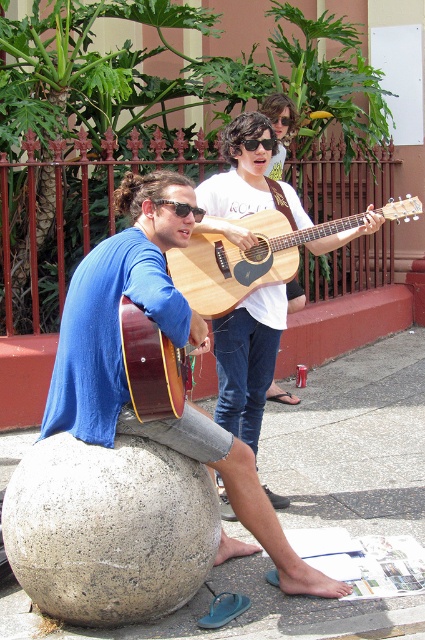
Can you confirm if gray concrete ball at lower left is taller than gray concrete sphere at lower left?

Correct, gray concrete ball at lower left is much taller as gray concrete sphere at lower left.

Does gray concrete ball at lower left have a lesser width compared to gray concrete sphere at lower left?

In fact, gray concrete ball at lower left might be wider than gray concrete sphere at lower left.

Between point (421, 340) and point (167, 472), which one is positioned in front?

Point (167, 472) is in front.

What are the coordinates of `gray concrete ball at lower left` in the screenshot? It's located at (354, 442).

Consider the image. Can you confirm if matte blue shirt at left is positioned to the right of natural wood guitar at center?

No, matte blue shirt at left is not to the right of natural wood guitar at center.

Does matte blue shirt at left have a lesser width compared to natural wood guitar at center?

No, matte blue shirt at left is not thinner than natural wood guitar at center.

Between point (90, 397) and point (243, 396), which one is positioned behind?

The point (243, 396) is more distant.

At what (x,y) coordinates should I click in order to perform the action: click on matte blue shirt at left. Please return your answer as a coordinate pair (x, y). The height and width of the screenshot is (640, 425). Looking at the image, I should click on (173, 342).

Is natural wood acoustic guitar at center bigger than sunglasses at center?

Yes.

Is the position of natural wood acoustic guitar at center more distant than that of sunglasses at center?

Yes, it is.

Does point (416, 212) come closer to viewer compared to point (184, 204)?

No, it is not.

Identify the location of natural wood acoustic guitar at center. [243, 259].